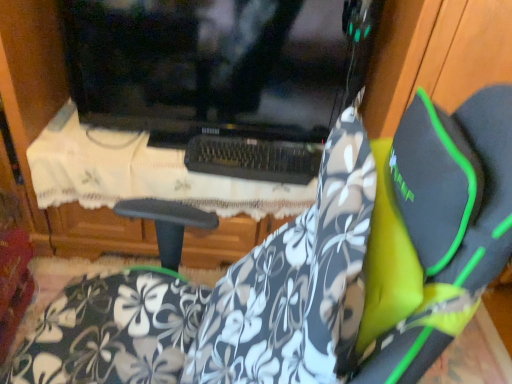
Describe the element at coordinates (295, 284) in the screenshot. I see `floral-patterned fabric at center` at that location.

Where is `floral-patterned fabric at center`? This screenshot has height=384, width=512. floral-patterned fabric at center is located at coordinates click(295, 284).

I want to click on white lace tablecloth at center, so click(x=142, y=174).

The width and height of the screenshot is (512, 384). What do you see at coordinates (142, 174) in the screenshot?
I see `white lace tablecloth at center` at bounding box center [142, 174].

In the scene shown: What is the approximate width of white lace tablecloth at center?

white lace tablecloth at center is 26.25 inches wide.

The height and width of the screenshot is (384, 512). I want to click on floral-patterned fabric at center, so click(295, 284).

Which object is positioned more to the right, white lace tablecloth at center or floral-patterned fabric at center?

floral-patterned fabric at center is more to the right.

Looking at this image, is the depth of white lace tablecloth at center greater than that of floral-patterned fabric at center?

Yes, white lace tablecloth at center is behind floral-patterned fabric at center.

Considering the positions of point (155, 174) and point (342, 240), is point (155, 174) closer or farther from the camera than point (342, 240)?

Point (155, 174) appears to be farther away from the viewer than point (342, 240).

From the image's perspective, who appears lower, white lace tablecloth at center or floral-patterned fabric at center?

floral-patterned fabric at center.

From a real-world perspective, is white lace tablecloth at center above or below floral-patterned fabric at center?

white lace tablecloth at center is below floral-patterned fabric at center.

Can you confirm if white lace tablecloth at center is wider than floral-patterned fabric at center?

Indeed, white lace tablecloth at center has a greater width compared to floral-patterned fabric at center.

From their relative heights in the image, would you say white lace tablecloth at center is taller or shorter than floral-patterned fabric at center?

Considering their sizes, white lace tablecloth at center has less height than floral-patterned fabric at center.

Considering the relative sizes of white lace tablecloth at center and floral-patterned fabric at center in the image provided, is white lace tablecloth at center bigger than floral-patterned fabric at center?

Yes, white lace tablecloth at center is bigger than floral-patterned fabric at center.

Can floral-patterned fabric at center be found inside white lace tablecloth at center?

Definitely not — floral-patterned fabric at center is not inside white lace tablecloth at center.

Is white lace tablecloth at center in contact with floral-patterned fabric at center?

white lace tablecloth at center and floral-patterned fabric at center are clearly separated.

Could you tell me if white lace tablecloth at center is facing floral-patterned fabric at center?

No, white lace tablecloth at center does not turn towards floral-patterned fabric at center.

I want to click on table located behind the floral-patterned fabric at center, so click(x=142, y=174).

Which object is positioned more to the right, floral-patterned fabric at center or white lace tablecloth at center?

floral-patterned fabric at center is more to the right.

Does floral-patterned fabric at center come behind white lace tablecloth at center?

No.

Does point (301, 216) lie in front of point (170, 174)?

That is True.

From the image's perspective, which one is positioned lower, floral-patterned fabric at center or white lace tablecloth at center?

floral-patterned fabric at center is shown below in the image.

From a real-world perspective, between floral-patterned fabric at center and white lace tablecloth at center, who is vertically higher?

In real-world perspective, floral-patterned fabric at center is above.

Looking at their sizes, would you say floral-patterned fabric at center is wider or thinner than white lace tablecloth at center?

Considering their sizes, floral-patterned fabric at center looks slimmer than white lace tablecloth at center.

From their relative heights in the image, would you say floral-patterned fabric at center is taller or shorter than white lace tablecloth at center?

In the image, floral-patterned fabric at center appears to be taller than white lace tablecloth at center.

Considering the sizes of floral-patterned fabric at center and white lace tablecloth at center in the image, is floral-patterned fabric at center bigger or smaller than white lace tablecloth at center?

Clearly, floral-patterned fabric at center is smaller in size than white lace tablecloth at center.

Is floral-patterned fabric at center not inside white lace tablecloth at center?

Indeed, floral-patterned fabric at center is completely outside white lace tablecloth at center.

Is floral-patterned fabric at center in contact with white lace tablecloth at center?

No, floral-patterned fabric at center is not touching white lace tablecloth at center.

Is floral-patterned fabric at center aimed at white lace tablecloth at center?

No, floral-patterned fabric at center is not turned towards white lace tablecloth at center.

Can you tell me how much floral-patterned fabric at center and white lace tablecloth at center differ in facing direction?

They differ by 47.1 degrees in their facing directions.

How much distance is there between floral-patterned fabric at center and white lace tablecloth at center?

floral-patterned fabric at center is 29.61 inches from white lace tablecloth at center.

The image size is (512, 384). Identify the location of fabric located below the white lace tablecloth at center (from the image's perspective). coord(295,284).

The height and width of the screenshot is (384, 512). In order to click on fabric lying on the right of white lace tablecloth at center in this screenshot , I will do `click(295, 284)`.

Locate an element on the screen. table located above the floral-patterned fabric at center (from the image's perspective) is located at coordinates (142, 174).